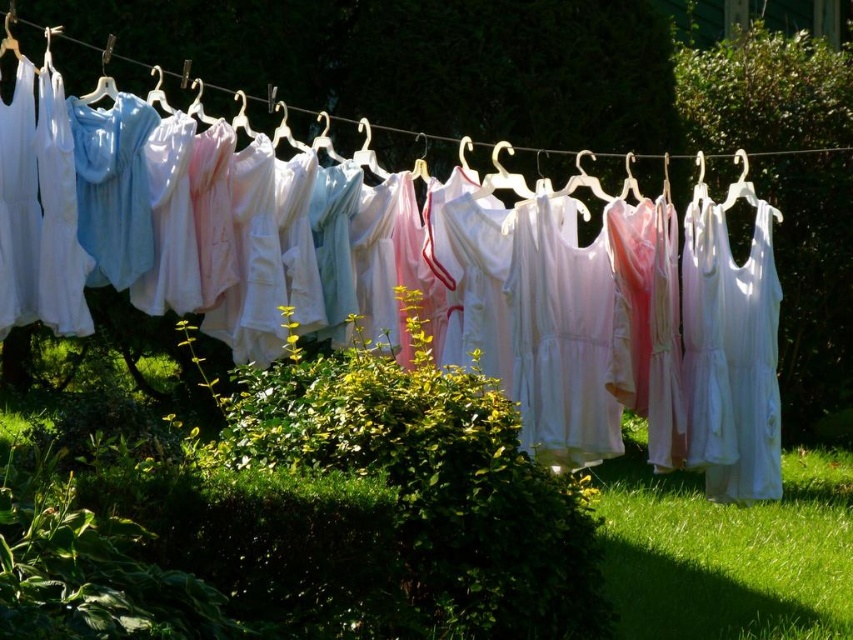
Who is more distant from viewer, (x=308, y=614) or (x=850, y=609)?

The point (x=850, y=609) is more distant.

Between point (260, 620) and point (810, 465), which one is positioned in front?

Point (260, 620) is more forward.

Where is `green grass at center`? The height and width of the screenshot is (640, 853). green grass at center is located at coordinates (465, 557).

I want to click on green grass at center, so click(x=465, y=557).

Who is higher up, white fabric at center or green grass at lower right?

white fabric at center

Does white fabric at center come behind green grass at lower right?

That is True.

Between point (846, 198) and point (776, 545), which one is positioned behind?

The point (846, 198) is behind.

Find the location of a particular element. The height and width of the screenshot is (640, 853). white fabric at center is located at coordinates (492, 83).

This screenshot has width=853, height=640. I want to click on white cotton dresses at center, so click(x=491, y=289).

Does white cotton dresses at center have a larger size compared to green grass at lower right?

Indeed, white cotton dresses at center has a larger size compared to green grass at lower right.

Where is `white cotton dresses at center`? This screenshot has height=640, width=853. white cotton dresses at center is located at coordinates (491, 289).